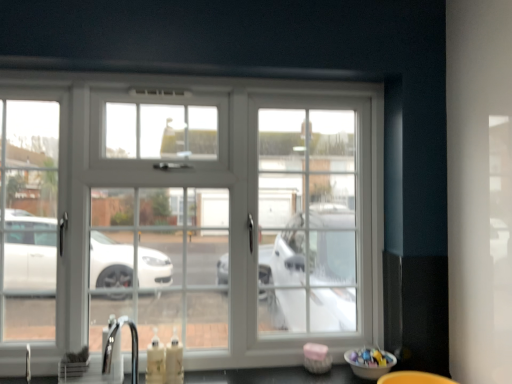
Question: Considering the relative sizes of satin nickel faucet at lower left and white glossy window at center in the image provided, is satin nickel faucet at lower left taller than white glossy window at center?

Choices:
 (A) yes
 (B) no

Answer: (B)

Question: Does satin nickel faucet at lower left have a lesser height compared to white glossy window at center?

Choices:
 (A) no
 (B) yes

Answer: (B)

Question: From the image's perspective, is satin nickel faucet at lower left under white glossy window at center?

Choices:
 (A) yes
 (B) no

Answer: (A)

Question: From a real-world perspective, is satin nickel faucet at lower left below white glossy window at center?

Choices:
 (A) yes
 (B) no

Answer: (A)

Question: From the image's perspective, is satin nickel faucet at lower left on top of white glossy window at center?

Choices:
 (A) no
 (B) yes

Answer: (A)

Question: Can you confirm if satin nickel faucet at lower left is positioned to the right of white glossy window at center?

Choices:
 (A) no
 (B) yes

Answer: (A)

Question: Considering the relative positions of white glossy window at center and satin nickel faucet at lower left in the image provided, is white glossy window at center to the right of satin nickel faucet at lower left from the viewer's perspective?

Choices:
 (A) no
 (B) yes

Answer: (B)

Question: Is the depth of white glossy window at center less than that of satin nickel faucet at lower left?

Choices:
 (A) no
 (B) yes

Answer: (A)

Question: From the image's perspective, is white glossy window at center on satin nickel faucet at lower left?

Choices:
 (A) yes
 (B) no

Answer: (A)

Question: Can we say white glossy window at center lies outside satin nickel faucet at lower left?

Choices:
 (A) yes
 (B) no

Answer: (A)

Question: Is white glossy window at center wider than satin nickel faucet at lower left?

Choices:
 (A) no
 (B) yes

Answer: (B)

Question: Is white glossy window at center beside satin nickel faucet at lower left?

Choices:
 (A) yes
 (B) no

Answer: (B)

Question: Looking at their shapes, would you say satin nickel faucet at lower left is wider or thinner than white glossy window at center?

Choices:
 (A) wide
 (B) thin

Answer: (B)